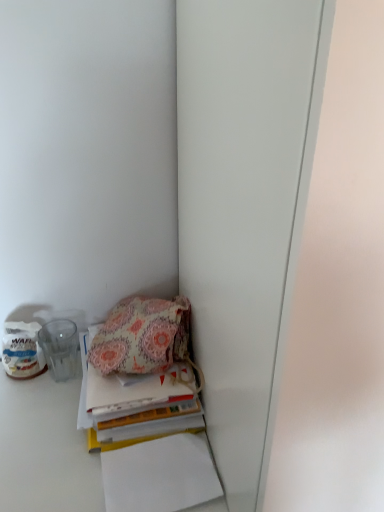
Question: Does floral fabric handbag at lower left have a greater height compared to floral fabric book at lower left?

Choices:
 (A) yes
 (B) no

Answer: (A)

Question: Could you tell me if floral fabric handbag at lower left is turned towards floral fabric book at lower left?

Choices:
 (A) no
 (B) yes

Answer: (A)

Question: Is floral fabric handbag at lower left to the left of floral fabric book at lower left from the viewer's perspective?

Choices:
 (A) yes
 (B) no

Answer: (A)

Question: Can you confirm if floral fabric handbag at lower left is positioned to the right of floral fabric book at lower left?

Choices:
 (A) yes
 (B) no

Answer: (B)

Question: Can you confirm if floral fabric handbag at lower left is smaller than floral fabric book at lower left?

Choices:
 (A) no
 (B) yes

Answer: (B)

Question: From the image's perspective, is floral fabric handbag at lower left over floral fabric book at lower left?

Choices:
 (A) yes
 (B) no

Answer: (A)

Question: Can you confirm if floral fabric book at lower left is smaller than floral fabric handbag at lower left?

Choices:
 (A) no
 (B) yes

Answer: (A)

Question: Is floral fabric book at lower left facing towards floral fabric handbag at lower left?

Choices:
 (A) yes
 (B) no

Answer: (B)

Question: Can you confirm if floral fabric book at lower left is wider than floral fabric handbag at lower left?

Choices:
 (A) no
 (B) yes

Answer: (B)

Question: Is floral fabric book at lower left further to the viewer compared to floral fabric handbag at lower left?

Choices:
 (A) no
 (B) yes

Answer: (A)

Question: Can we say floral fabric book at lower left lies outside floral fabric handbag at lower left?

Choices:
 (A) no
 (B) yes

Answer: (B)

Question: Is floral fabric handbag at lower left inside floral fabric book at lower left?

Choices:
 (A) no
 (B) yes

Answer: (A)

Question: Is point (168, 313) positioned closer to the camera than point (92, 422)?

Choices:
 (A) closer
 (B) farther

Answer: (B)